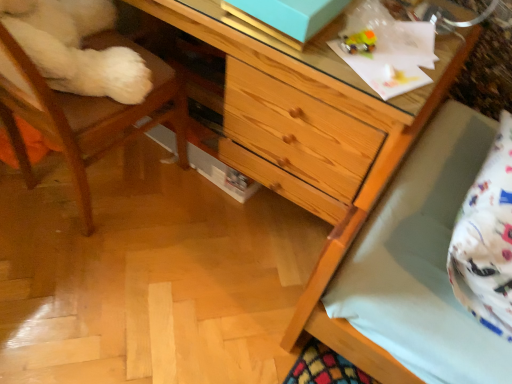
At what (x,y) coordinates should I click in order to perform the action: click on vacant area that lies to the right of translucent plastic toy at upper right. Please return your answer as a coordinate pair (x, y). The height and width of the screenshot is (384, 512). Looking at the image, I should click on (412, 56).